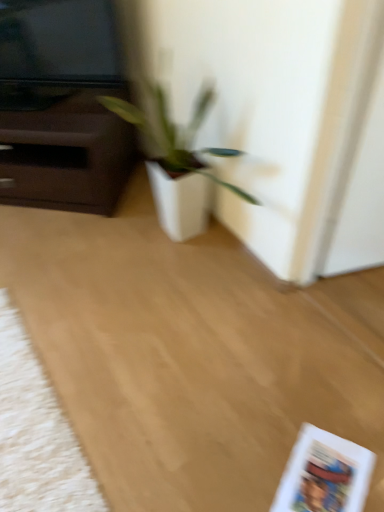
Question: Does point (319, 459) appear closer or farther from the camera than point (203, 450)?

Choices:
 (A) farther
 (B) closer

Answer: (B)

Question: In terms of height, does white matte paperback book at lower right look taller or shorter compared to white matte plant pot at center?

Choices:
 (A) tall
 (B) short

Answer: (B)

Question: Considering the real-world distances, which object is farthest from the white fluffy mat at lower left?

Choices:
 (A) white matte plant pot at center
 (B) white matte pot at center
 (C) white matte paperback book at lower right

Answer: (B)

Question: Which object is the closest to the white matte pot at center?

Choices:
 (A) white fluffy mat at lower left
 (B) white matte plant pot at center
 (C) white matte paperback book at lower right

Answer: (B)